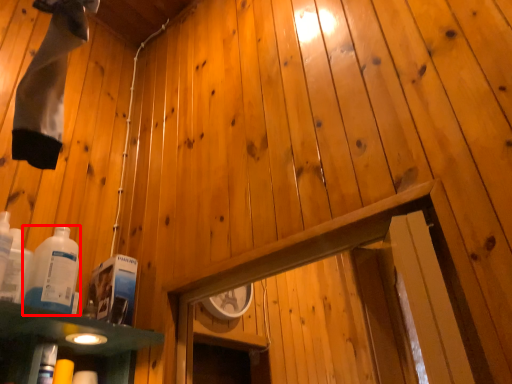
Question: From the image's perspective, where is bottle (annotated by the red box) located in relation to bottle in the image?

Choices:
 (A) above
 (B) below

Answer: (B)